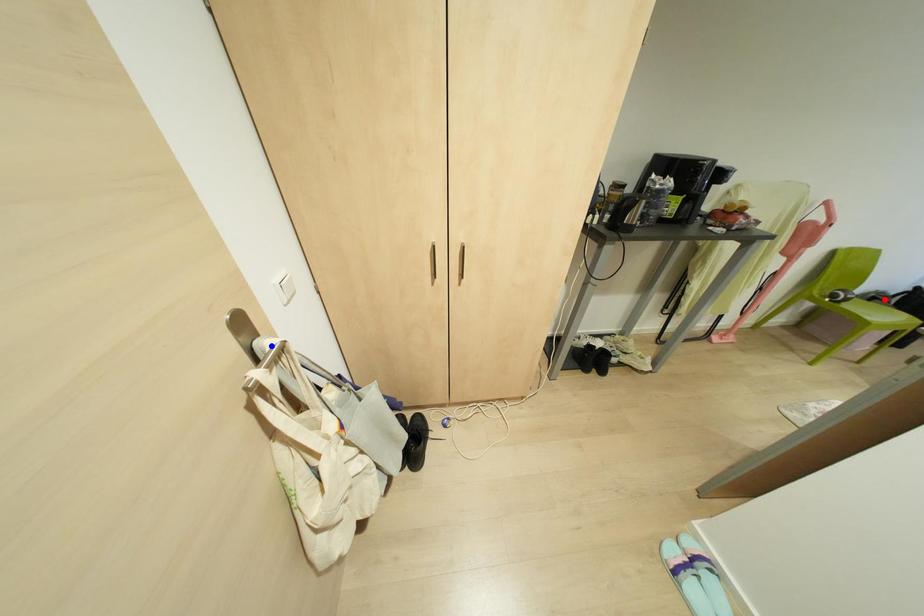
Question: Two points are marked on the image. Which point is closer to the camera?

Choices:
 (A) Blue point is closer.
 (B) Red point is closer.

Answer: (A)